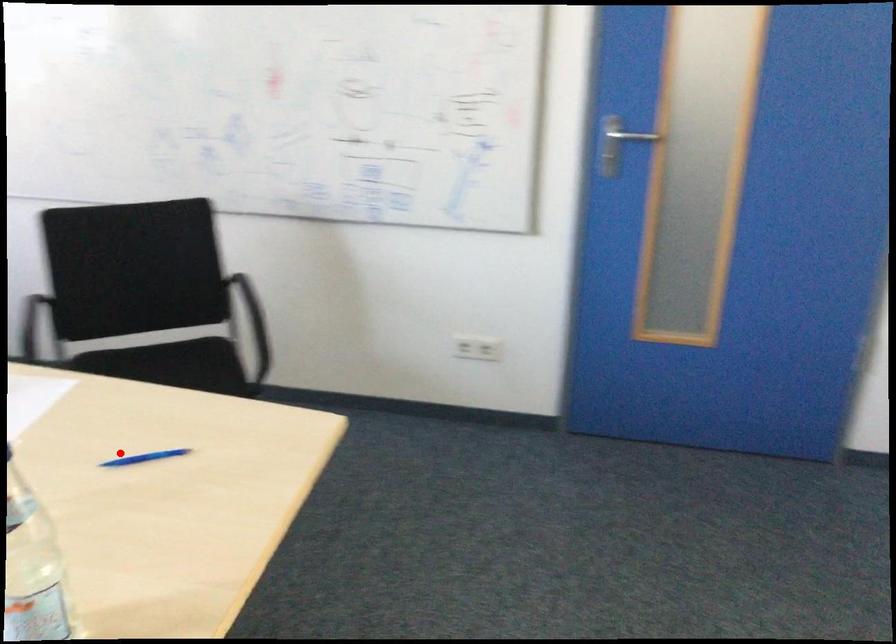
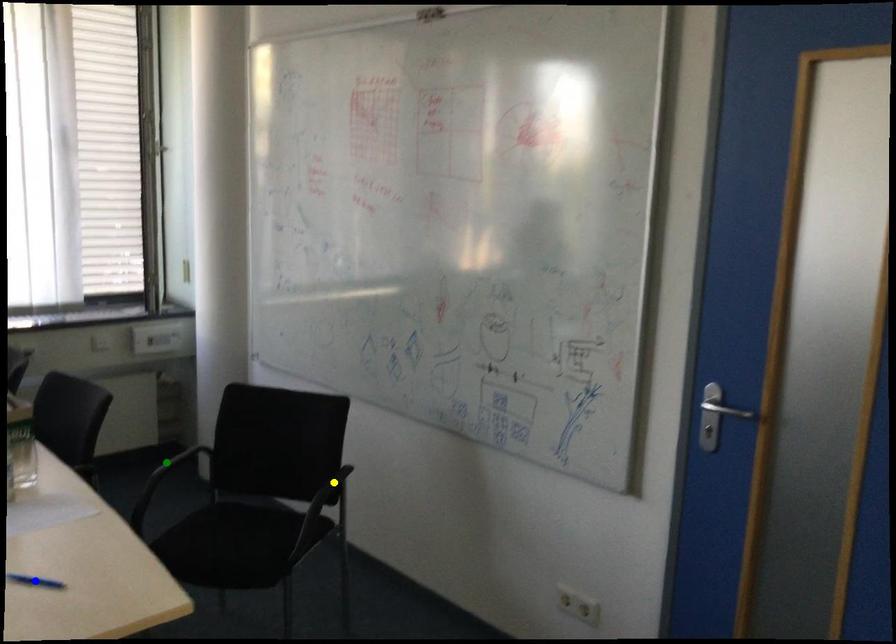
Question: I am providing you with two images of the same scene from different viewpoints. A red point is marked on the first image. You are given multiple points on the second image. Which spot in image 2 lines up with the point in image 1?

Choices:
 (A) blue point
 (B) green point
 (C) yellow point

Answer: (A)